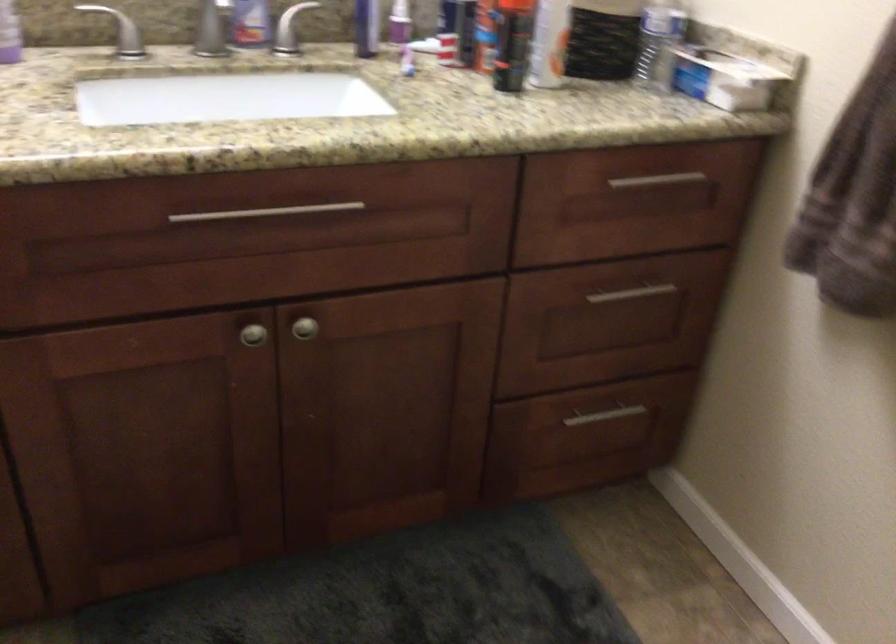
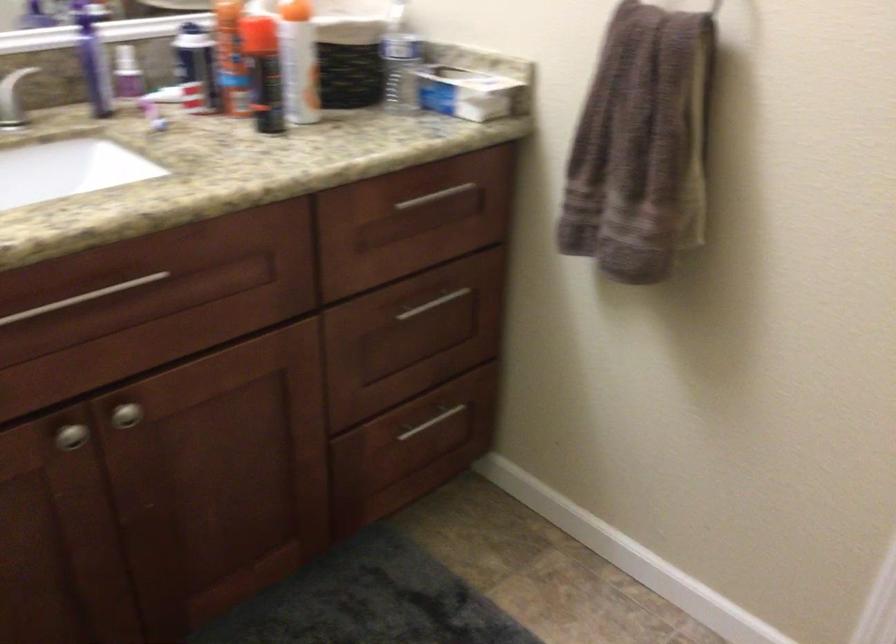
The point at (280, 211) is marked in the first image. Where is the corresponding point in the second image?

(82, 298)